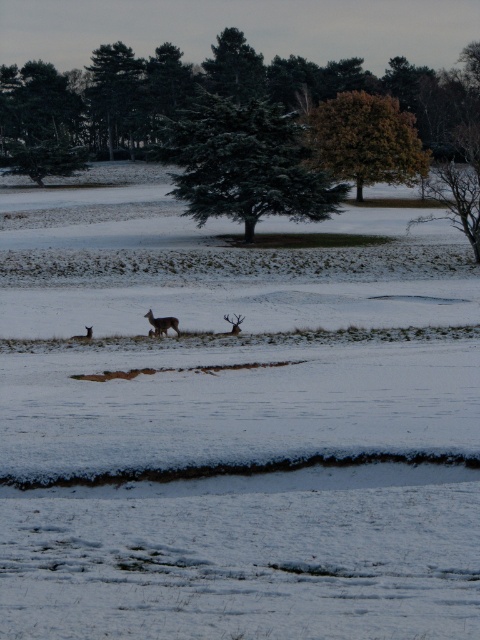
Question: Is green matte tree at center to the right of green matte tree at upper center from the viewer's perspective?

Choices:
 (A) yes
 (B) no

Answer: (A)

Question: Which of the following is the farthest from the observer?

Choices:
 (A) (235, 316)
 (B) (168, 122)
 (C) (147, 312)
 (D) (348, 97)

Answer: (D)

Question: Which point is closer to the camera?

Choices:
 (A) (152, 316)
 (B) (186, 193)
 (C) (130, 52)
 (D) (233, 326)

Answer: (A)

Question: Does green matte tree at upper center appear under brown matte/deer at lower left?

Choices:
 (A) yes
 (B) no

Answer: (B)

Question: Considering the relative positions of green matte tree at center and brown fur deer at center in the image provided, where is green matte tree at center located with respect to brown fur deer at center?

Choices:
 (A) left
 (B) right

Answer: (A)

Question: Estimate the real-world distances between objects in this image. Which object is farther from the brown textured tree at center?

Choices:
 (A) brown matte/deer at center
 (B) brown matte/deer at lower left

Answer: (B)